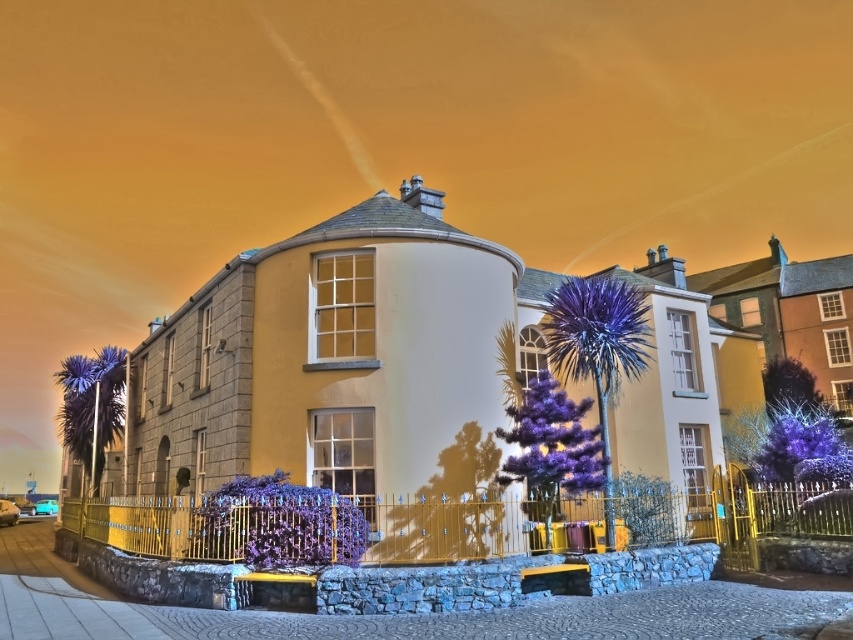
Does purple metallic palm tree at center appear on the left side of purple spiky palm at left?

In fact, purple metallic palm tree at center is to the right of purple spiky palm at left.

Is purple metallic palm tree at center wider than purple spiky palm at left?

Yes, purple metallic palm tree at center is wider than purple spiky palm at left.

Who is more distant from viewer, (589, 364) or (91, 356)?

Positioned behind is point (91, 356).

You are a GUI agent. You are given a task and a screenshot of the screen. Output one action in this format:
    pyautogui.click(x=<x>, y=<y>)
    Task: Click on the purple metallic palm tree at center
    This screenshot has height=640, width=853.
    Given the screenshot: What is the action you would take?
    pyautogui.click(x=598, y=348)